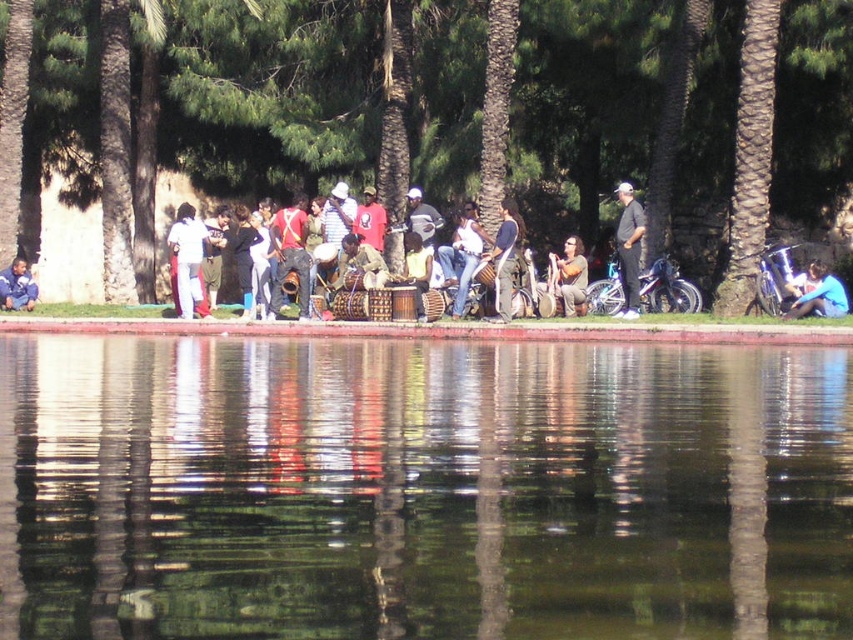
Question: Which of the following is the closest to the observer?

Choices:
 (A) (341, 484)
 (B) (439, 250)
 (C) (502, 300)

Answer: (A)

Question: Can you confirm if denim jeans at center is positioned to the right of dark blue fabric shirt at center?

Choices:
 (A) no
 (B) yes

Answer: (A)

Question: Can you confirm if brown textured tree at center is positioned to the right of denim jeans at center?

Choices:
 (A) yes
 (B) no

Answer: (B)

Question: Which of the following is the closest to the observer?

Choices:
 (A) denim jeans at center
 (B) brushed metal jacket at center
 (C) brown rough palm tree at right
 (D) matte brown guitar at center

Answer: (A)

Question: Which point is closer to the camera?

Choices:
 (A) (642, 58)
 (B) (503, 278)

Answer: (B)

Question: Can you confirm if dark gray shirt at center is wider than brushed metal jacket at center?

Choices:
 (A) no
 (B) yes

Answer: (A)